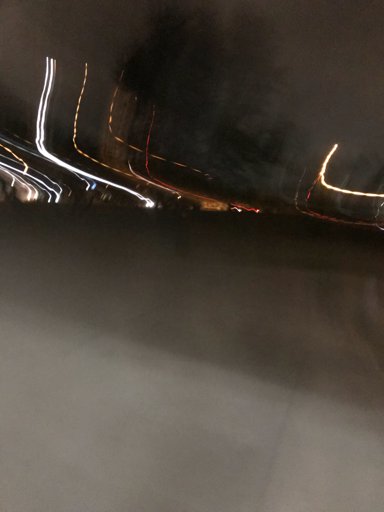
This screenshot has height=512, width=384. Find the location of `dark grey floor`. dark grey floor is located at coordinates pyautogui.click(x=317, y=316).